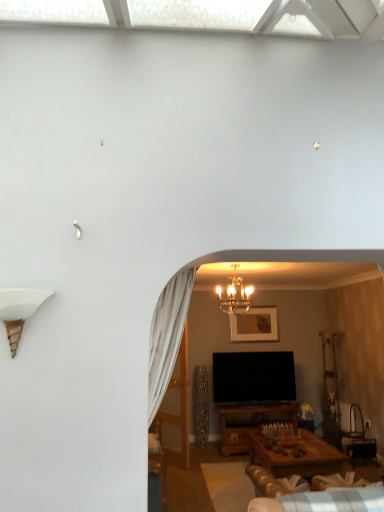
Question: Does plush beige couch at lower center have a lesser height compared to gold metallic chandelier at center?

Choices:
 (A) yes
 (B) no

Answer: (A)

Question: Is plush beige couch at lower center not inside gold metallic chandelier at center?

Choices:
 (A) no
 (B) yes

Answer: (B)

Question: Considering the relative positions of plush beige couch at lower center and gold metallic chandelier at center in the image provided, is plush beige couch at lower center to the right of gold metallic chandelier at center from the viewer's perspective?

Choices:
 (A) no
 (B) yes

Answer: (B)

Question: Does plush beige couch at lower center lie in front of gold metallic chandelier at center?

Choices:
 (A) no
 (B) yes

Answer: (B)

Question: From the image's perspective, does plush beige couch at lower center appear higher than gold metallic chandelier at center?

Choices:
 (A) no
 (B) yes

Answer: (A)

Question: From the image's perspective, is gold metallic chandelier at center above or below gold-framed picture at upper center?

Choices:
 (A) above
 (B) below

Answer: (A)

Question: Do you think gold metallic chandelier at center is within gold-framed picture at upper center, or outside of it?

Choices:
 (A) inside
 (B) outside

Answer: (B)

Question: From a real-world perspective, is gold metallic chandelier at center positioned above or below gold-framed picture at upper center?

Choices:
 (A) above
 (B) below

Answer: (A)

Question: Looking at their shapes, would you say gold metallic chandelier at center is wider or thinner than gold-framed picture at upper center?

Choices:
 (A) thin
 (B) wide

Answer: (B)

Question: Based on their sizes in the image, would you say gold-framed picture at upper center is bigger or smaller than translucent glass door at center?

Choices:
 (A) small
 (B) big

Answer: (A)

Question: Considering the positions of point (256, 330) and point (168, 413), is point (256, 330) closer or farther from the camera than point (168, 413)?

Choices:
 (A) farther
 (B) closer

Answer: (A)

Question: From a real-world perspective, is gold-framed picture at upper center positioned above or below translucent glass door at center?

Choices:
 (A) below
 (B) above

Answer: (B)

Question: Based on their positions, is gold-framed picture at upper center located to the left or right of translucent glass door at center?

Choices:
 (A) left
 (B) right

Answer: (B)

Question: Is point (223, 309) closer or farther from the camera than point (342, 495)?

Choices:
 (A) farther
 (B) closer

Answer: (A)

Question: From the image's perspective, is gold metallic chandelier at center above or below plush beige couch at lower center?

Choices:
 (A) above
 (B) below

Answer: (A)